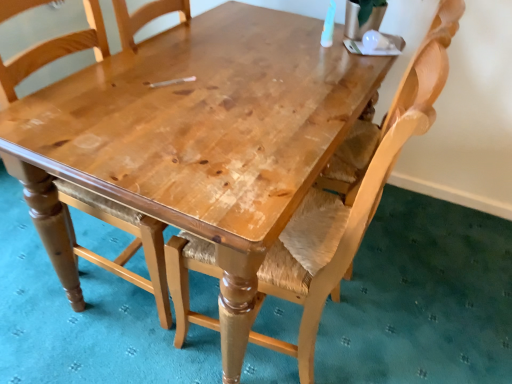
Question: Should I look upward or downward to see light brown wood chair at center, positioned as the 1th chair in left-to-right order?

Choices:
 (A) up
 (B) down

Answer: (A)

Question: Should I look upward or downward to see wooden chair with woven seat at center, the 1th chair when ordered from right to left?

Choices:
 (A) down
 (B) up

Answer: (A)

Question: Is wooden chair with woven seat at center, the 2th chair from the left, not inside light brown wood chair at center, the 2th chair viewed from the right?

Choices:
 (A) no
 (B) yes

Answer: (B)

Question: Is wooden chair with woven seat at center, the 2th chair from the left, positioned before light brown wood chair at center, positioned as the 1th chair in left-to-right order?

Choices:
 (A) yes
 (B) no

Answer: (A)

Question: Is the depth of wooden chair with woven seat at center, the 2th chair from the left, greater than that of light brown wood chair at center, positioned as the 1th chair in left-to-right order?

Choices:
 (A) yes
 (B) no

Answer: (B)

Question: From a real-world perspective, is wooden chair with woven seat at center, the 2th chair from the left, physically below light brown wood chair at center, the 2th chair viewed from the right?

Choices:
 (A) no
 (B) yes

Answer: (A)

Question: Is wooden chair with woven seat at center, the 2th chair from the left, oriented towards light brown wood chair at center, the 2th chair viewed from the right?

Choices:
 (A) no
 (B) yes

Answer: (B)

Question: Is light brown wood chair at center, positioned as the 1th chair in left-to-right order, a part of wooden chair with woven seat at center, the 2th chair from the left?

Choices:
 (A) no
 (B) yes

Answer: (A)

Question: Is light brown wood chair at center, positioned as the 1th chair in left-to-right order, not near wooden chair with woven seat at center, the 2th chair from the left?

Choices:
 (A) yes
 (B) no

Answer: (B)

Question: Does light brown wood chair at center, the 2th chair viewed from the right, come behind wooden chair with woven seat at center, the 1th chair when ordered from right to left?

Choices:
 (A) yes
 (B) no

Answer: (A)

Question: Is the depth of light brown wood chair at center, the 2th chair viewed from the right, less than that of wooden chair with woven seat at center, the 2th chair from the left?

Choices:
 (A) yes
 (B) no

Answer: (B)

Question: Does light brown wood chair at center, the 2th chair viewed from the right, have a smaller size compared to wooden chair with woven seat at center, the 1th chair when ordered from right to left?

Choices:
 (A) yes
 (B) no

Answer: (A)

Question: From the image's perspective, does light brown wood chair at center, positioned as the 1th chair in left-to-right order, appear higher than wooden chair with woven seat at center, the 1th chair when ordered from right to left?

Choices:
 (A) yes
 (B) no

Answer: (A)

Question: Can you confirm if light brown wood chair at center, positioned as the 1th chair in left-to-right order, is positioned to the left of wooden chair with woven seat at center, the 1th chair when ordered from right to left?

Choices:
 (A) yes
 (B) no

Answer: (A)

Question: Is wooden chair with woven seat at center, the 2th chair from the left, bigger or smaller than light brown wood chair at center, positioned as the 1th chair in left-to-right order?

Choices:
 (A) big
 (B) small

Answer: (A)